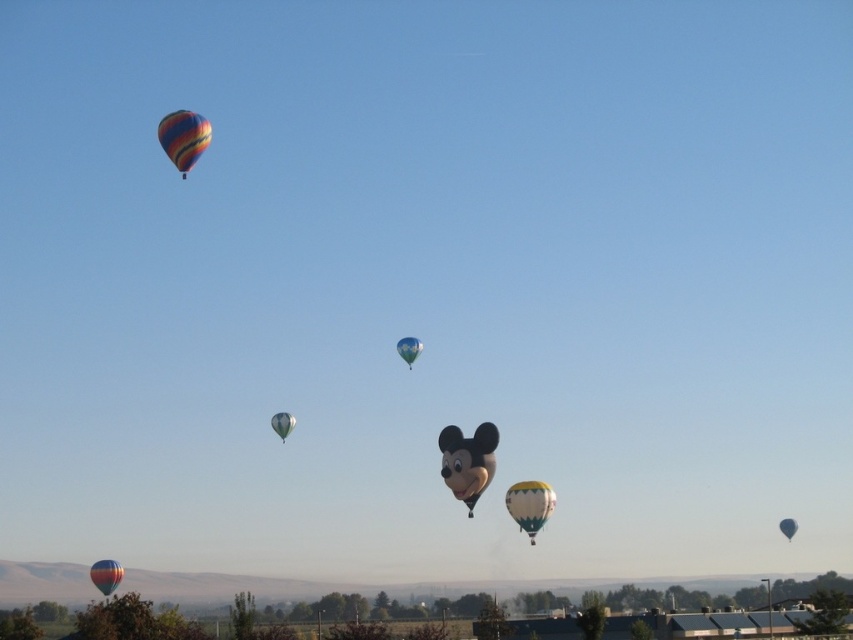
Question: Among these objects, which one is nearest to the camera?

Choices:
 (A) multicolored fabric hot air balloon at upper left
 (B) yellow-green striped hot air balloon at center
 (C) blue glossy balloon at center

Answer: (A)

Question: Is yellow-green striped hot air balloon at center to the right of matte red balloon at lower left from the viewer's perspective?

Choices:
 (A) yes
 (B) no

Answer: (A)

Question: Which object is the closest to the matte silver balloon at center?

Choices:
 (A) matte black mickey mouse head at center
 (B) yellow-green striped hot air balloon at center
 (C) blue glossy balloon at center
 (D) multicolored fabric hot air balloon at upper left

Answer: (C)

Question: Among these points, which one is nearest to the camera?

Choices:
 (A) (190, 113)
 (B) (463, 481)

Answer: (A)

Question: Does matte red balloon at lower left have a larger size compared to blue glossy balloon at upper center?

Choices:
 (A) yes
 (B) no

Answer: (A)

Question: Considering the relative positions of matte black mickey mouse head at center and blue glossy balloon at upper center in the image provided, where is matte black mickey mouse head at center located with respect to blue glossy balloon at upper center?

Choices:
 (A) above
 (B) below

Answer: (A)